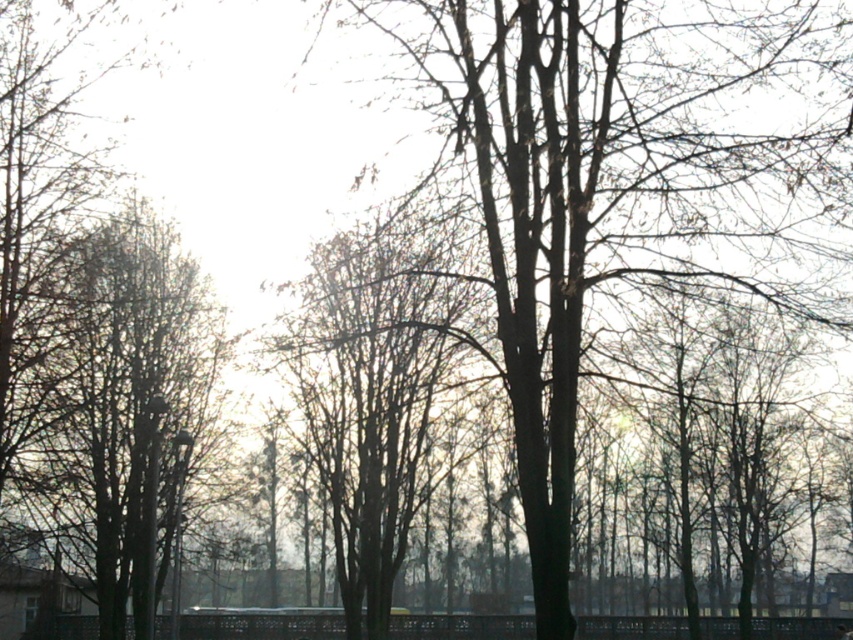
Can you confirm if smooth bark tree at center is positioned below bare branches at center?

Actually, smooth bark tree at center is above bare branches at center.

Locate an element on the screen. The height and width of the screenshot is (640, 853). smooth bark tree at center is located at coordinates (616, 182).

Is point (695, 60) behind point (280, 352)?

That is False.

You are a GUI agent. You are given a task and a screenshot of the screen. Output one action in this format:
    pyautogui.click(x=<x>, y=<y>)
    Task: Click on the smooth bark tree at center
    
    Given the screenshot: What is the action you would take?
    pyautogui.click(x=616, y=182)

Between smooth bark tree at center and smooth brown tree at left, which one appears on the right side from the viewer's perspective?

Positioned to the right is smooth bark tree at center.

Does smooth bark tree at center appear under smooth brown tree at left?

Actually, smooth bark tree at center is above smooth brown tree at left.

Is point (718, 60) positioned in front of point (99, 484)?

Yes.

Identify the location of smooth bark tree at center. (616, 182).

Where is `smooth brown tree at left`? smooth brown tree at left is located at coordinates (132, 412).

Who is more forward, (149, 307) or (302, 330)?

Point (302, 330) is more forward.

Between point (148, 298) and point (397, 556), which one is positioned behind?

The point (397, 556) is behind.

The width and height of the screenshot is (853, 640). In order to click on smooth brown tree at left in this screenshot , I will do `click(132, 412)`.